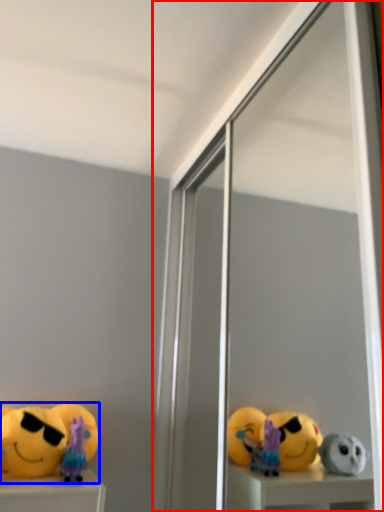
Question: Which of the following is the closest to the observer, screen door (highlighted by a red box) or toy (highlighted by a blue box)?

Choices:
 (A) screen door
 (B) toy

Answer: (A)